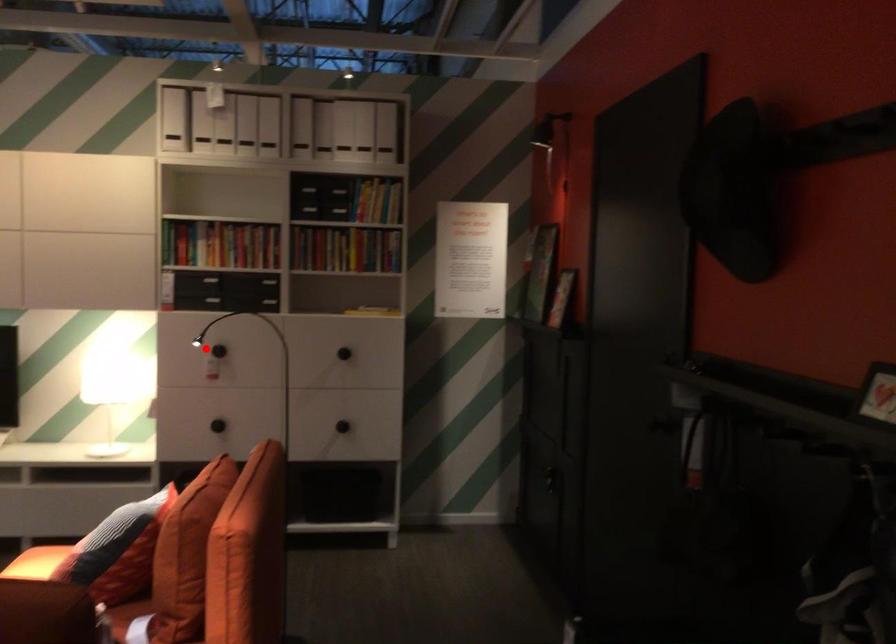
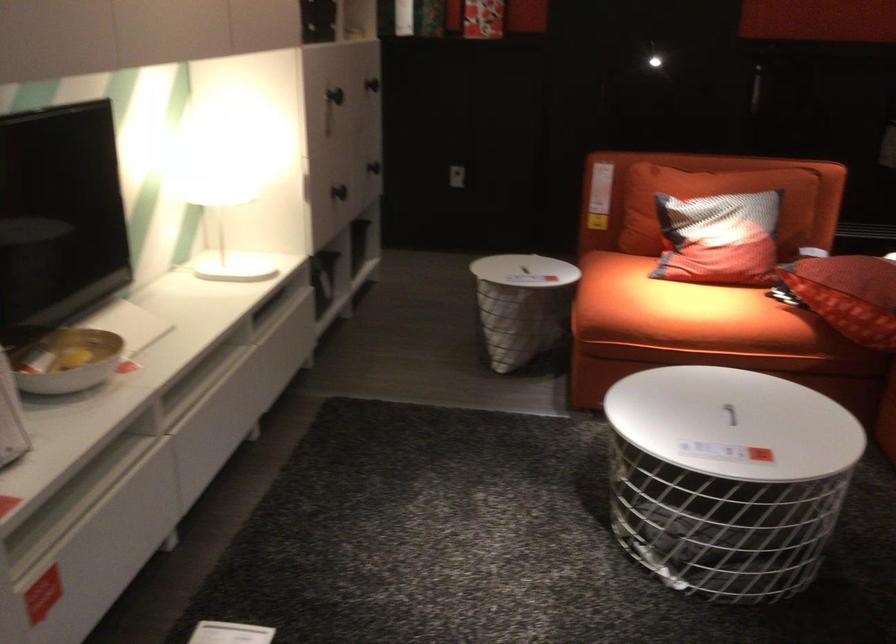
Question: I am providing you with two images of the same scene from different viewpoints. In image1, a red point is highlighted. Considering the same 3D point in image2, which of the following is correct?

Choices:
 (A) It is closer
 (B) It is farther

Answer: (A)